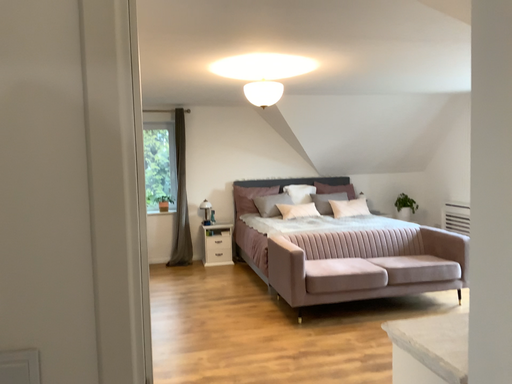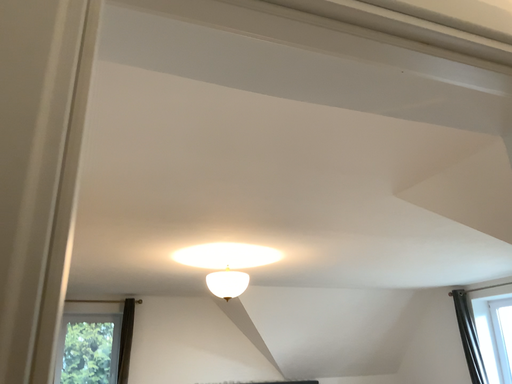
Question: How did the camera likely rotate when shooting the video?

Choices:
 (A) rotated upward
 (B) rotated downward

Answer: (A)